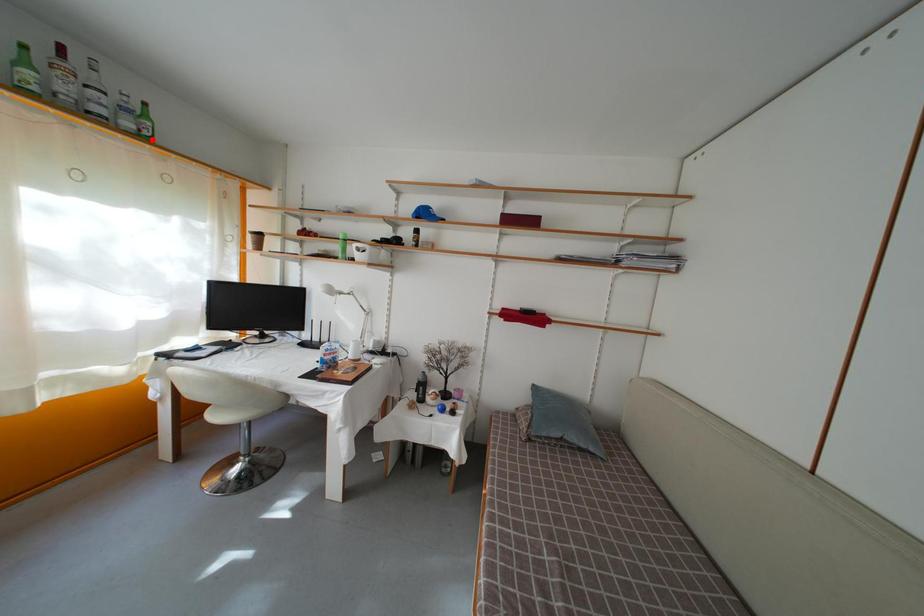
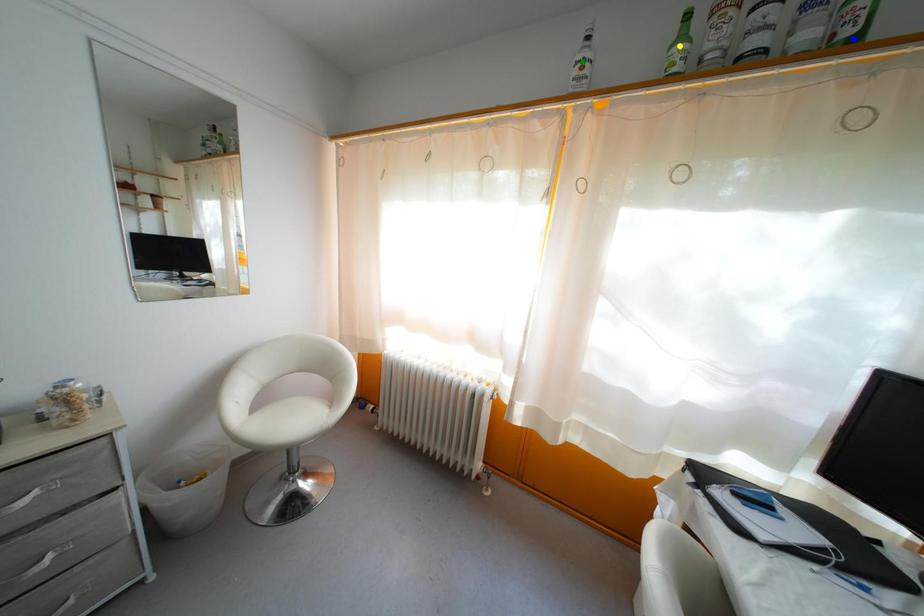
Question: I am providing you with two images of the same scene from different viewpoints. A red point is marked on the first image. You are given multiple points on the second image. Which point in image 2 is actually the same real-world point as the red point in image 1?

Choices:
 (A) green point
 (B) yellow point
 (C) blue point

Answer: (C)